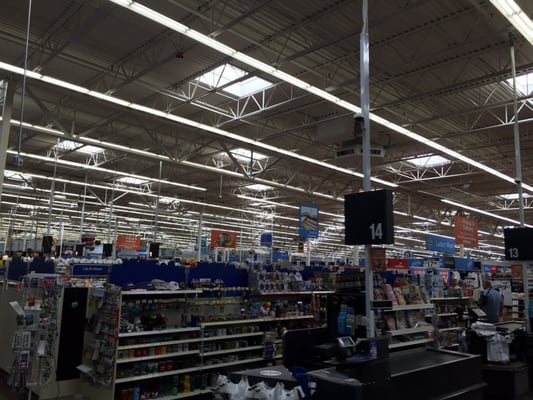
Find the location of `check out counter`. check out counter is located at coordinates (421, 359).